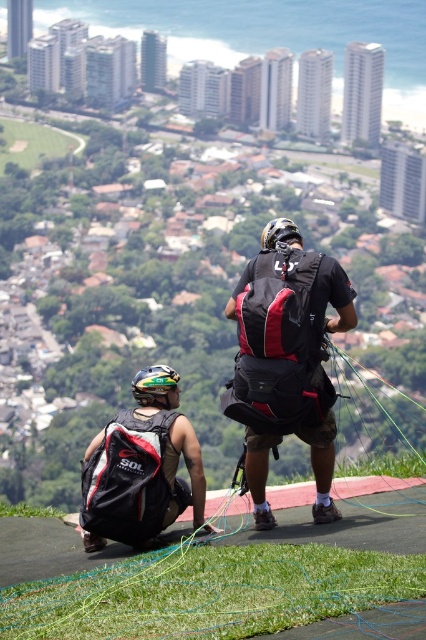
Does matte black backpack at center have a smaller size compared to matte black backpack at lower left?

Incorrect, matte black backpack at center is not smaller in size than matte black backpack at lower left.

Between matte black backpack at center and matte black backpack at lower left, which one has more height?

With more height is matte black backpack at center.

Is point (294, 278) in front of point (100, 432)?

Yes, it is in front of point (100, 432).

Where is `matte black backpack at center`? The height and width of the screenshot is (640, 426). matte black backpack at center is located at coordinates (287, 358).